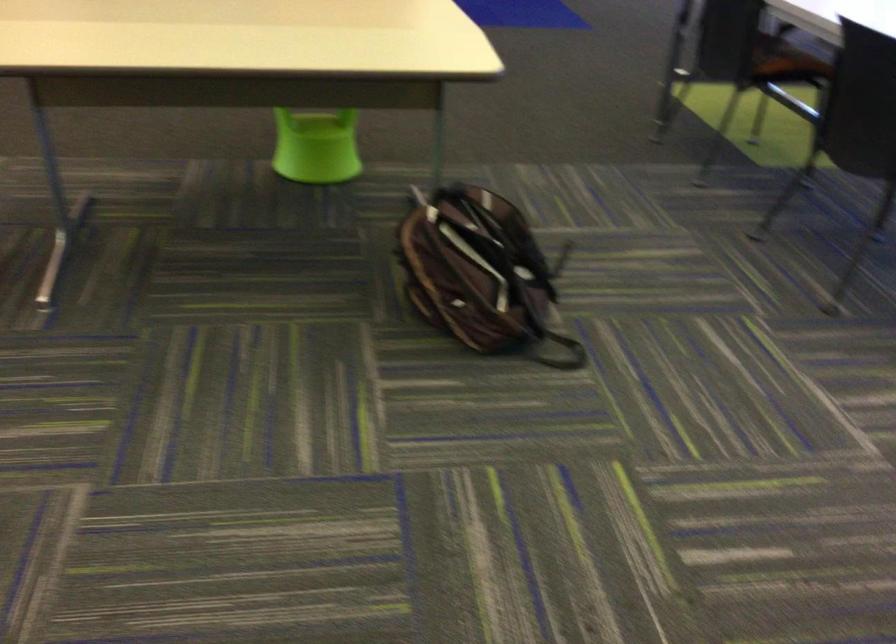
Where would you lift the brown backpack? Please return your answer as a coordinate pair (x, y).

(479, 272)